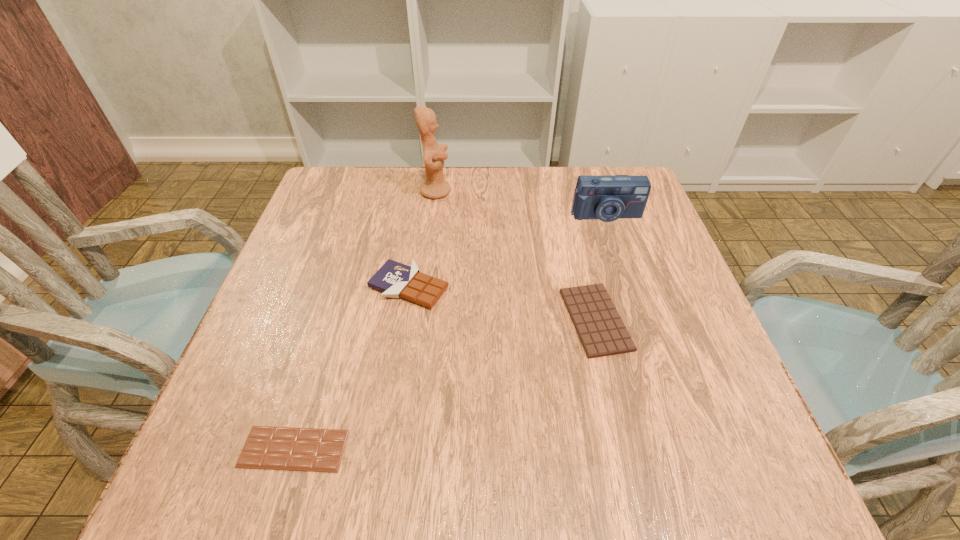
You are a GUI agent. You are given a task and a screenshot of the screen. Output one action in this format:
    pyautogui.click(x=<x>, y=<y>)
    Task: Click on the chocolate bar that is the third nearest to the farthest object
    This screenshot has height=540, width=960.
    Given the screenshot: What is the action you would take?
    pyautogui.click(x=275, y=448)

Identify the location of vacant region that satisfies the following two spatial constraints: 1. on the front-facing side of the farthest object; 2. on the right side of the second shortest chocolate bar. (420, 320).

You are a GUI agent. You are given a task and a screenshot of the screen. Output one action in this format:
    pyautogui.click(x=<x>, y=<y>)
    Task: Click on the free point that satisfies the following two spatial constraints: 1. on the front-facing side of the figurine; 2. on the back side of the second tallest chocolate bar
    
    Given the screenshot: What is the action you would take?
    pyautogui.click(x=420, y=320)

I want to click on vacant region that satisfies the following two spatial constraints: 1. on the front-facing side of the farthest object; 2. on the right side of the rightmost chocolate bar, so click(x=420, y=320).